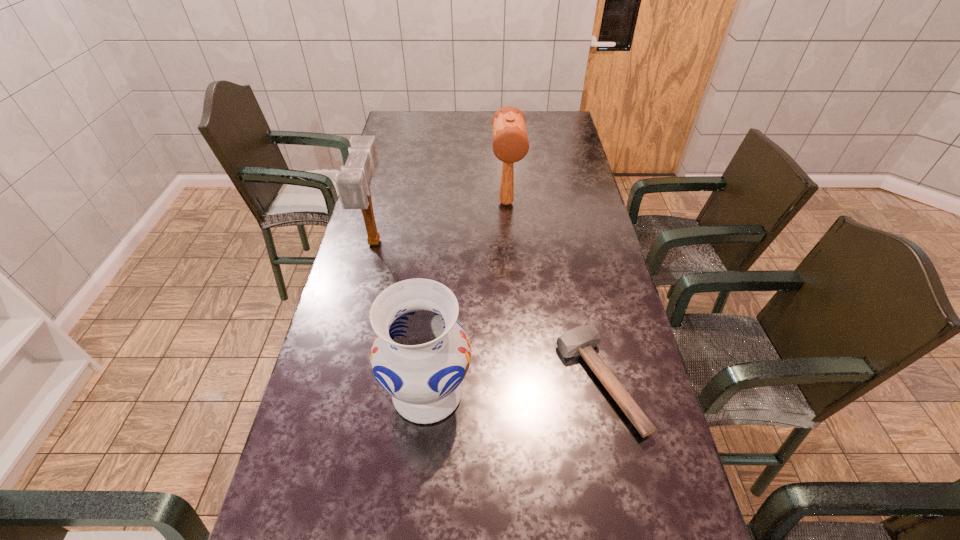
At what (x,y) coordinates should I click in order to perform the action: click on object that is positioned at the right edge. Please return your answer as a coordinate pair (x, y). This screenshot has height=540, width=960. Looking at the image, I should click on (581, 340).

In the image, there is a desktop. Where is `blank space at the left edge`? blank space at the left edge is located at coordinates (388, 199).

Locate an element on the screen. The height and width of the screenshot is (540, 960). free space at the right edge is located at coordinates (612, 422).

The width and height of the screenshot is (960, 540). Identify the location of vacant area at the far left corner of the desktop. click(395, 130).

This screenshot has width=960, height=540. What are the coordinates of `free space between the rightmost mallet and the third object from right to left` in the screenshot? It's located at (514, 387).

Where is `free space between the leftmost mallet and the shortest mallet`? This screenshot has height=540, width=960. free space between the leftmost mallet and the shortest mallet is located at coordinates (487, 312).

Find the location of `vacant space that's between the leftmost mallet and the second mallet from left to right`. vacant space that's between the leftmost mallet and the second mallet from left to right is located at coordinates (441, 222).

The image size is (960, 540). In order to click on empty location between the second mallet from right to left and the third object from right to left in this screenshot , I will do `click(467, 298)`.

Identify the location of vacant area between the rightmost mallet and the leftmost object. (487, 312).

At what (x,y) coordinates should I click in order to perform the action: click on free space between the vase and the shortest object. Please return your answer as a coordinate pair (x, y). Looking at the image, I should click on (514, 387).